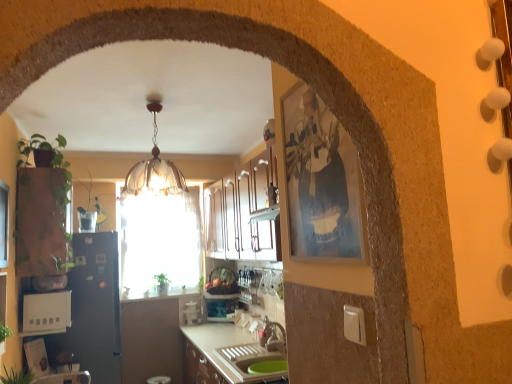
Locate an element on the screen. This screenshot has width=512, height=384. vacant point above white glossy countertop at center (from a real-world perspective) is located at coordinates (230, 339).